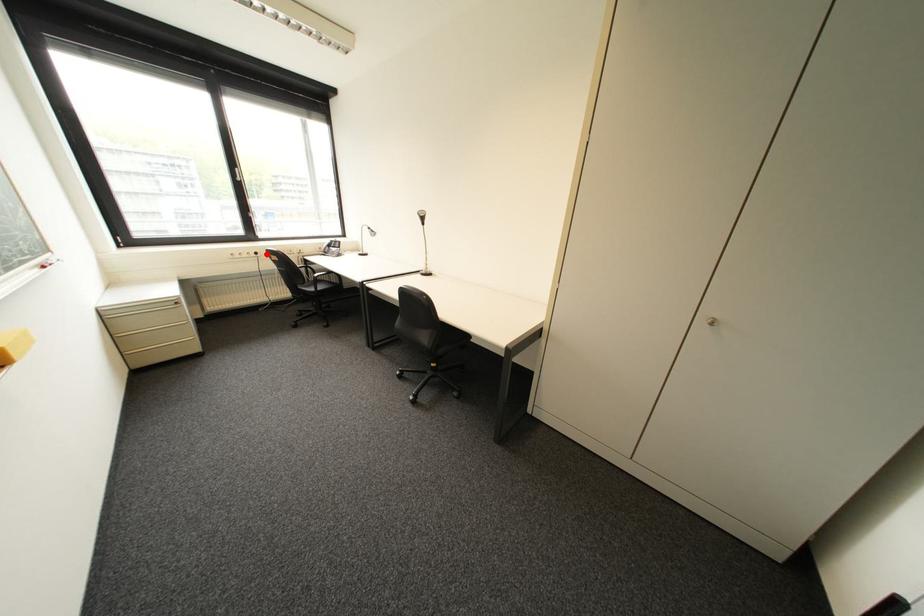
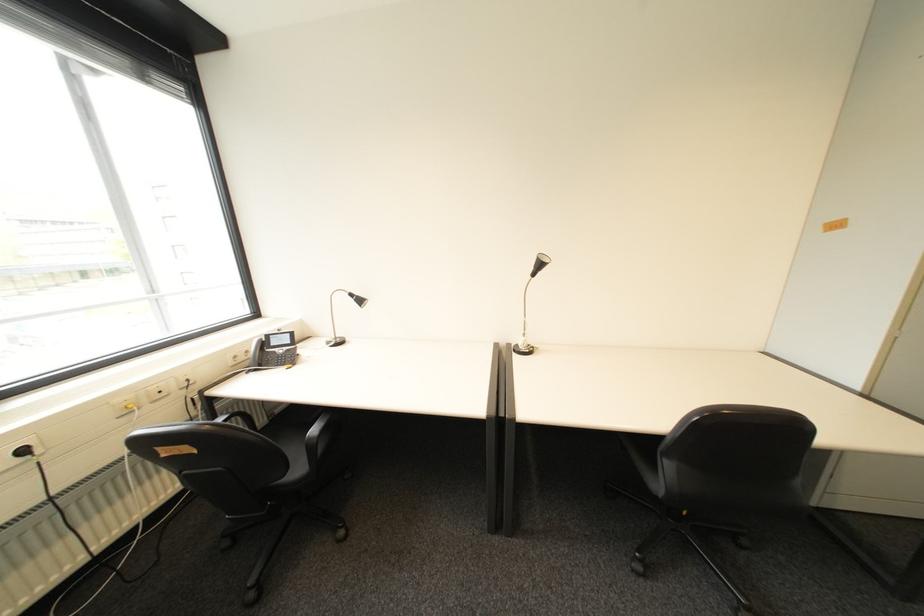
Question: I am providing you with two images of the same scene from different viewpoints. A red point is shown in image1. For the corresponding object point in image2, is it positioned nearer or farther from the camera?

Choices:
 (A) Nearer
 (B) Farther

Answer: (B)